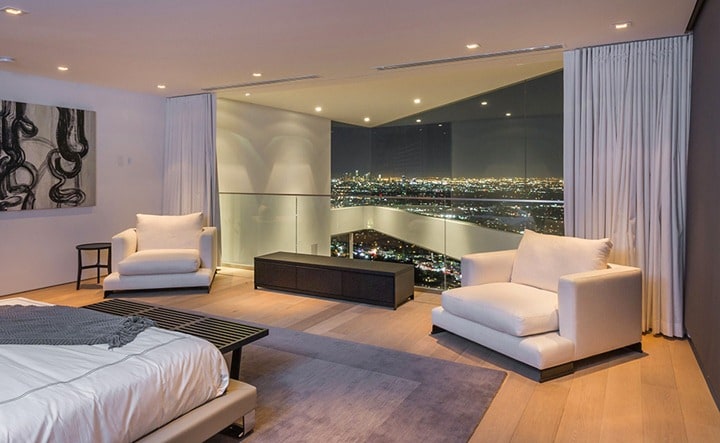
Identify the location of painting. Image resolution: width=720 pixels, height=443 pixels. (47, 186).